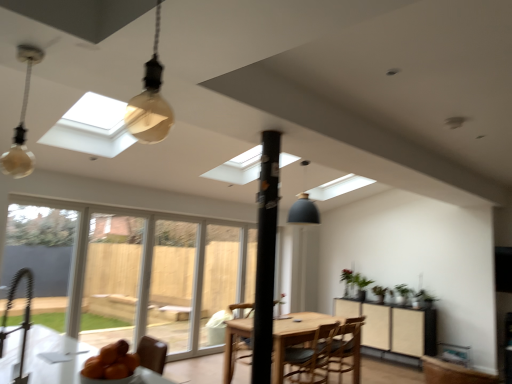
At what (x,y) coordinates should I click in order to perform the action: click on clear glass door at center, the second screen door positioned from the right. Please return your answer as a coordinate pair (x, y). Image resolution: width=512 pixels, height=384 pixels. Looking at the image, I should click on (172, 283).

What is the approximate width of clear glass door at center, the 2th screen door in the front-to-back sequence?

clear glass door at center, the 2th screen door in the front-to-back sequence, is 4.17 inches wide.

You are a GUI agent. You are given a task and a screenshot of the screen. Output one action in this format:
    pyautogui.click(x=<x>, y=<y>)
    Task: Click on the matte black cabinet at center right
    
    Given the screenshot: What is the action you would take?
    pyautogui.click(x=393, y=330)

Measure the distance between point (266,353) and camera.

Point (266,353) is 2.65 meters from camera.

Describe the element at coordinates (111, 362) in the screenshot. I see `orange matte bowl at lower left` at that location.

You are a GUI agent. You are given a task and a screenshot of the screen. Output one action in this format:
    pyautogui.click(x=<x>, y=<y>)
    Task: Click on the clear glass screen door at left, the third screen door viewed from the back
    This screenshot has height=384, width=512.
    Given the screenshot: What is the action you would take?
    pyautogui.click(x=113, y=275)

From the picture: Which of these two, green matte plant at right or transparent plastic screen door at center, positioned as the 1th screen door in back-to-front order, is thinner?

Thinner between the two is transparent plastic screen door at center, positioned as the 1th screen door in back-to-front order.

There is a transparent plastic screen door at center, positioned as the 1th screen door in back-to-front order. Identify the location of plant above it (from a real-world perspective). Image resolution: width=512 pixels, height=384 pixels. (355, 279).

Is green matte plant at right facing away from transparent plastic screen door at center, the third screen door when ordered from left to right?

No.

From the image's perspective, is green matte plant at right beneath transparent plastic screen door at center, positioned as the 1th screen door in back-to-front order?

Yes.

Is black matte pole at center spatially inside translucent glass bulb at upper center, the first light fixture positioned from the left, or outside of it?

black matte pole at center is outside translucent glass bulb at upper center, the first light fixture positioned from the left.

Is black matte pole at center oriented away from translucent glass bulb at upper center, the first light fixture positioned from the left?

No, black matte pole at center is not facing away from translucent glass bulb at upper center, the first light fixture positioned from the left.

Can you confirm if black matte pole at center is bigger than translucent glass bulb at upper center, which is the 1th light fixture from front to back?

Yes, black matte pole at center is bigger than translucent glass bulb at upper center, which is the 1th light fixture from front to back.

From the image's perspective, which object appears higher, wooden chair at center, acting as the 2th chair starting from the front, or matte gray pendant lamp at center, the 1th light fixture in the right-to-left sequence?

matte gray pendant lamp at center, the 1th light fixture in the right-to-left sequence.

Which object is thinner, wooden chair at center, placed as the first chair when sorted from back to front, or matte gray pendant lamp at center, which ranks as the second light fixture in left-to-right order?

matte gray pendant lamp at center, which ranks as the second light fixture in left-to-right order, is thinner.

Can matte gray pendant lamp at center, placed as the second light fixture when sorted from front to back, be found inside wooden chair at center, placed as the first chair when sorted from back to front?

No, wooden chair at center, placed as the first chair when sorted from back to front, does not contain matte gray pendant lamp at center, placed as the second light fixture when sorted from front to back.

Consider the image. Can you tell me how much wooden chair at center, placed as the first chair when sorted from back to front, and matte gray pendant lamp at center, the first light fixture viewed from the back, differ in facing direction?

178 degrees.

Which is behind, matte glass bulb at upper left or translucent glass bulb at upper center, the 2th light fixture viewed from the back?

matte glass bulb at upper left.

How different are the orientations of matte glass bulb at upper left and translucent glass bulb at upper center, the 2th light fixture viewed from the back, in degrees?

The angular difference between matte glass bulb at upper left and translucent glass bulb at upper center, the 2th light fixture viewed from the back, is 92.5 degrees.

Does matte glass bulb at upper left have a lesser height compared to translucent glass bulb at upper center, which is the 2th light fixture in right-to-left order?

No.

Does point (28, 65) lie behind point (152, 58)?

Yes.

Considering the sizes of matte black cabinet at center right and matte gray pendant lamp at center, which ranks as the second light fixture in left-to-right order, in the image, is matte black cabinet at center right taller or shorter than matte gray pendant lamp at center, which ranks as the second light fixture in left-to-right order,?

Considering their sizes, matte black cabinet at center right has more height than matte gray pendant lamp at center, which ranks as the second light fixture in left-to-right order.

Considering the relative sizes of matte black cabinet at center right and matte gray pendant lamp at center, the 1th light fixture in the right-to-left sequence, in the image provided, is matte black cabinet at center right wider than matte gray pendant lamp at center, the 1th light fixture in the right-to-left sequence,?

Yes, matte black cabinet at center right is wider than matte gray pendant lamp at center, the 1th light fixture in the right-to-left sequence.

Is matte gray pendant lamp at center, the 1th light fixture in the right-to-left sequence, a part of matte black cabinet at center right?

No, matte gray pendant lamp at center, the 1th light fixture in the right-to-left sequence, is located outside of matte black cabinet at center right.

Based on their sizes in the image, would you say matte black cabinet at center right is bigger or smaller than black matte pole at center?

Clearly, matte black cabinet at center right is larger in size than black matte pole at center.

Is black matte pole at center completely or partially inside matte black cabinet at center right?

No, matte black cabinet at center right does not contain black matte pole at center.

Find the location of a particular element. cabinetry behind the black matte pole at center is located at coordinates (393, 330).

How many degrees apart are the facing directions of orange matte bowl at lower left and green matte plant at right?

They differ by 179 degrees in their facing directions.

This screenshot has height=384, width=512. Find the location of `fruit in front of the green matte plant at right`. fruit in front of the green matte plant at right is located at coordinates (111, 362).

Is orange matte bowl at lower left not near green matte plant at right?

Yes, orange matte bowl at lower left and green matte plant at right are quite far apart.

Looking at their sizes, would you say orange matte bowl at lower left is wider or thinner than green matte plant at right?

Clearly, orange matte bowl at lower left has less width compared to green matte plant at right.

Locate an element on the screen. the 1st screen door in front of the green matte plant at right, starting your count from the anchor is located at coordinates (219, 281).

From a real-world perspective, starting from the black matte pole at center, which light fixture is the 1st one vertically above it? Please provide its 2D coordinates.

[(150, 100)]

Estimate the real-world distances between objects in this image. Which object is further from black matte pole at center, green matte plant at right or transparent plastic screen door at center, positioned as the 1th screen door in back-to-front order?

Among the two, green matte plant at right is located further to black matte pole at center.

Which object lies further to the anchor point clear glass door at center, the second screen door viewed from the left, matte black cabinet at center right or orange matte bowl at lower left?

Among the two, orange matte bowl at lower left is located further to clear glass door at center, the second screen door viewed from the left.

Consider the image. When comparing their distances from matte black cabinet at center right, does clear glass screen door at left, positioned as the 1th screen door in left-to-right order, or green matte plant at right seem closer?

green matte plant at right.

From the image, which object appears to be farther from wooden table at lower left, green matte plant at right or wooden chair at center, which is the second chair from back to front?

green matte plant at right is further to wooden table at lower left.

From the image, which object appears to be nearer to clear glass door at center, the second screen door viewed from the left, matte black cabinet at center right or transparent plastic screen door at center, positioned as the first screen door in right-to-left order?

transparent plastic screen door at center, positioned as the first screen door in right-to-left order, lies closer to clear glass door at center, the second screen door viewed from the left, than the other object.

Which object lies further to the anchor point matte black cabinet at center right, black matte pole at center or matte gray pendant lamp at center, which ranks as the second light fixture in left-to-right order?

black matte pole at center lies further to matte black cabinet at center right than the other object.

Based on their spatial positions, is matte glass bulb at upper left or matte gray pendant lamp at center, the 1th light fixture in the right-to-left sequence, further from transparent plastic screen door at center, positioned as the first screen door in right-to-left order?

matte glass bulb at upper left is positioned further to the anchor transparent plastic screen door at center, positioned as the first screen door in right-to-left order.

When comparing their distances from matte black cabinet at center right, does green matte plant at right or translucent glass bulb at upper center, which is the 2th light fixture in right-to-left order, seem further?

Among the two, translucent glass bulb at upper center, which is the 2th light fixture in right-to-left order, is located further to matte black cabinet at center right.

Image resolution: width=512 pixels, height=384 pixels. What are the coordinates of `light fixture located between matte glass bulb at upper left and green matte plant at right in the depth direction` in the screenshot? It's located at (303, 205).

At what (x,y) coordinates should I click in order to perform the action: click on fruit positioned between translucent glass bulb at upper center, which is the 1th light fixture from front to back, and transparent plastic screen door at center, which is counted as the 3th screen door, starting from the front, from near to far. Please return your answer as a coordinate pair (x, y). Looking at the image, I should click on (111, 362).

Locate an element on the screen. The image size is (512, 384). light fixture between translucent glass bulb at upper center, which is the 1th light fixture from front to back, and clear glass door at center, the second screen door viewed from the left, from front to back is located at coordinates (303, 205).

Identify the location of table between matte glass bulb at upper left and wooden chair at center, which ranks as the 1th chair in front-to-back order, along the z-axis. (52, 351).